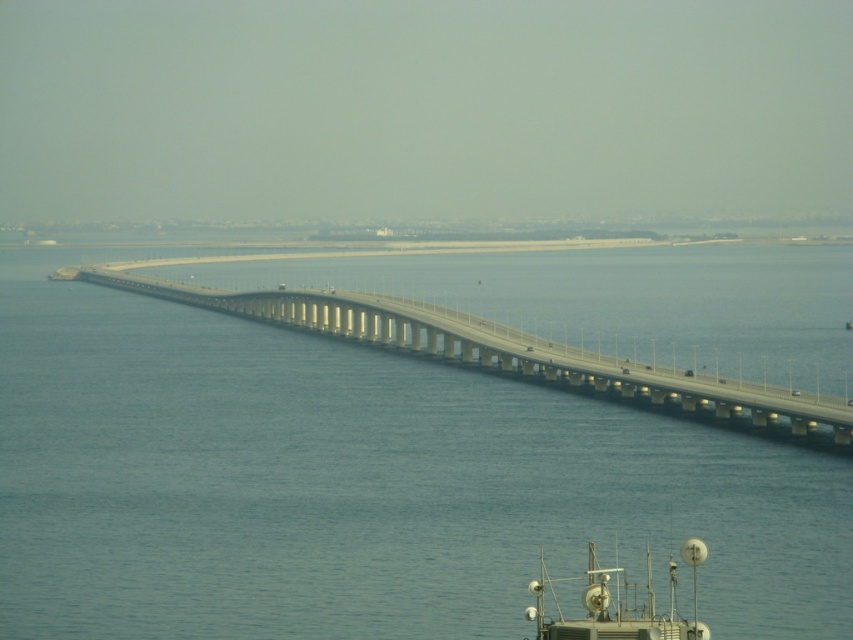
Question: Estimate the real-world distances between objects in this image. Which object is closer to the metallic gray satellite dish at lower right?

Choices:
 (A) blue water at center
 (B) concrete bridge at center

Answer: (A)

Question: Which of the following is the closest to the observer?

Choices:
 (A) metallic gray satellite dish at lower right
 (B) concrete bridge at center

Answer: (A)

Question: Is blue water at center positioned at the back of concrete bridge at center?

Choices:
 (A) yes
 (B) no

Answer: (B)

Question: Does blue water at center appear on the left side of concrete bridge at center?

Choices:
 (A) yes
 (B) no

Answer: (A)

Question: Does concrete bridge at center appear under metallic gray satellite dish at lower right?

Choices:
 (A) yes
 (B) no

Answer: (B)

Question: Which point is farther to the camera?

Choices:
 (A) metallic gray satellite dish at lower right
 (B) concrete bridge at center

Answer: (B)